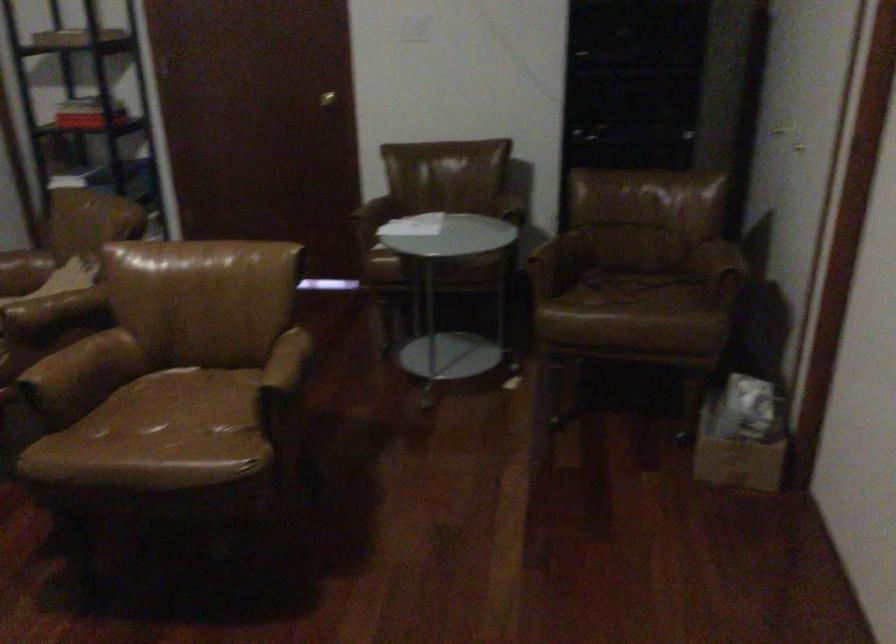
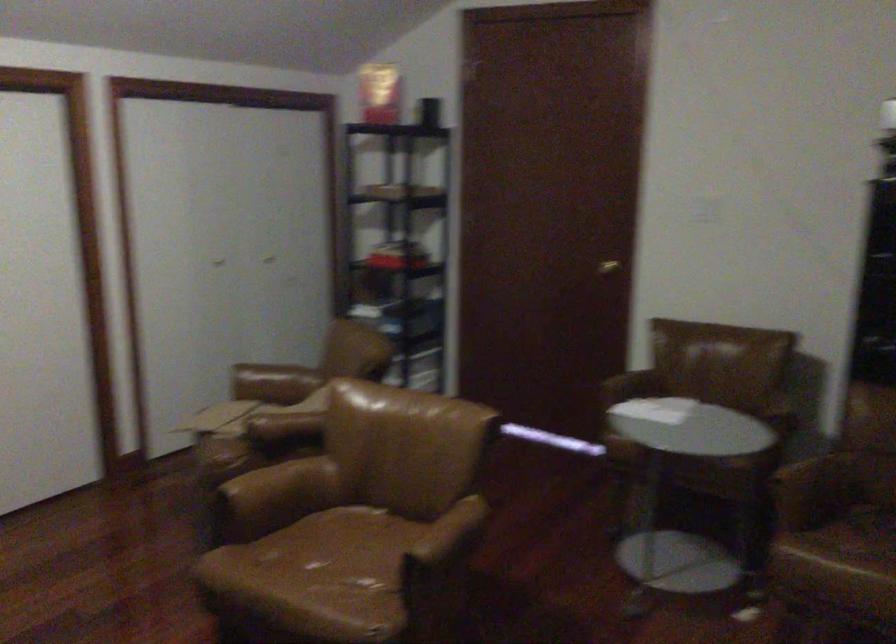
In the second image, find the point that corresponds to point (76, 357) in the first image.

(280, 484)